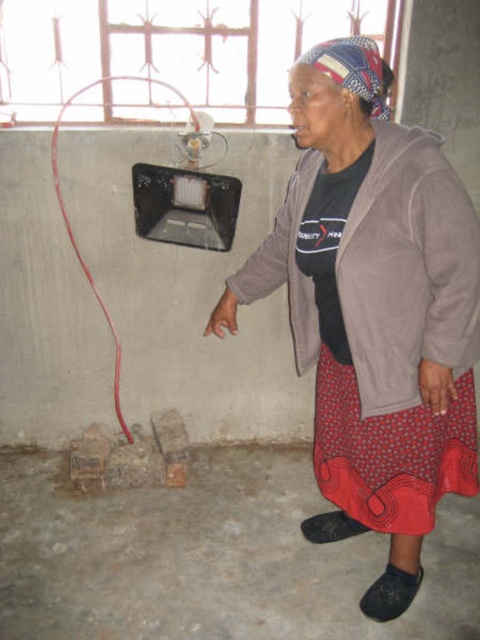
You are an interior designer assessing the space. You notice the matte gray jacket at center and the red rubber wire at left. Which object would cast a larger shadow given they are both exposed to the same light source from the window?

The matte gray jacket at center is bigger than the red rubber wire at left, so it would cast a larger shadow.

A contractor needs to install a new window in the room. The current window is at point [375,465]. The contractor has a ladder that is 2 meters long. If the ladder is placed at the base of the wall where the woman is standing, will it reach the window?

The distance between the woman and the window at point [375,465] is 1.90 meters. Since the ladder is 2 meters long, it will reach the window.

You are an interior designer assessing the space in the image. You need to place a new decorative item that requires a surface wider than the red rubber wire at left. Can the matte gray jacket at center provide a suitable surface for this item?

The matte gray jacket at center has a width larger than the red rubber wire at left, so it can provide a suitable surface for the decorative item requiring a wider space.